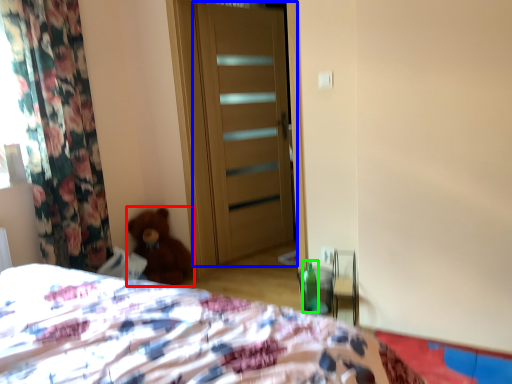
Question: Which object is positioned closest to teddy bear (highlighted by a red box)? Select from door (highlighted by a blue box) and bottle (highlighted by a green box).

Choices:
 (A) door
 (B) bottle

Answer: (A)